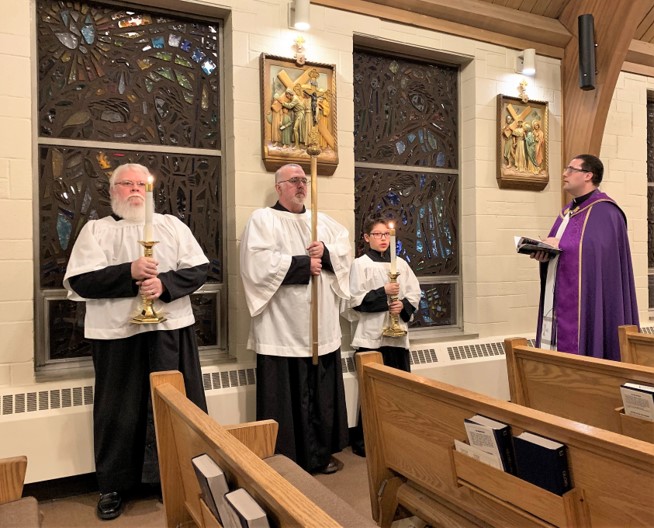
Locate an element on the screen. pew is located at coordinates (634, 339), (562, 382), (409, 411), (210, 429), (18, 482).